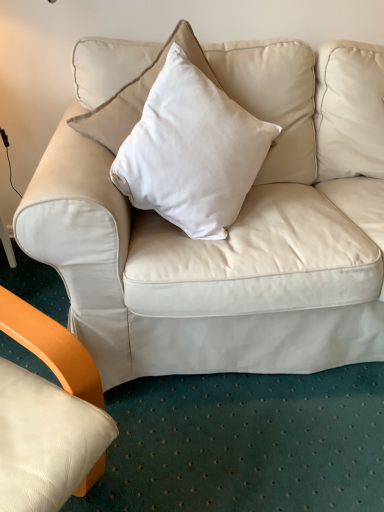
Question: Is white soft cushion at center positioned far away from matte white couch at center?

Choices:
 (A) yes
 (B) no

Answer: (B)

Question: Is the depth of white soft cushion at center greater than that of matte white couch at center?

Choices:
 (A) yes
 (B) no

Answer: (B)

Question: From the image's perspective, is white soft cushion at center over matte white couch at center?

Choices:
 (A) no
 (B) yes

Answer: (A)

Question: Does white soft cushion at center lie in front of matte white couch at center?

Choices:
 (A) no
 (B) yes

Answer: (B)

Question: Can you confirm if white soft cushion at center is smaller than matte white couch at center?

Choices:
 (A) yes
 (B) no

Answer: (A)

Question: Can you confirm if white soft cushion at center is taller than matte white couch at center?

Choices:
 (A) yes
 (B) no

Answer: (B)

Question: Does matte white couch at center appear on the right side of white soft cushion at center?

Choices:
 (A) yes
 (B) no

Answer: (B)

Question: From the image's perspective, does matte white couch at center appear higher than white soft cushion at center?

Choices:
 (A) yes
 (B) no

Answer: (A)

Question: Would you consider matte white couch at center to be distant from white soft cushion at center?

Choices:
 (A) yes
 (B) no

Answer: (B)

Question: Is matte white couch at center bigger than white soft cushion at center?

Choices:
 (A) no
 (B) yes

Answer: (B)

Question: From a real-world perspective, is matte white couch at center located higher than white soft cushion at center?

Choices:
 (A) no
 (B) yes

Answer: (A)

Question: From the image's perspective, is matte white couch at center below white soft cushion at center?

Choices:
 (A) yes
 (B) no

Answer: (B)

Question: Is white soft cushion at center inside or outside of matte white couch at center?

Choices:
 (A) inside
 (B) outside

Answer: (A)